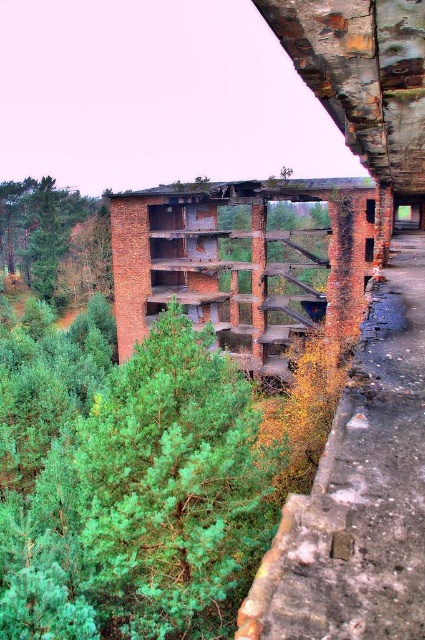
Is rusty brick bridge at center positioned in front of rusty metal overpass at upper center?

No, rusty brick bridge at center is further to the viewer.

Between point (269, 188) and point (424, 22), which one is positioned in front?

Point (424, 22)

Locate an element on the screen. The width and height of the screenshot is (425, 640). rusty brick bridge at center is located at coordinates (240, 262).

Which is in front, point (252, 244) or point (68, 256)?

Point (252, 244) is in front.

Is point (147, 292) farther from camera compared to point (28, 212)?

No, (147, 292) is closer to viewer.

Does point (186, 289) come closer to viewer compared to point (64, 304)?

Yes, point (186, 289) is in front of point (64, 304).

Where is `rusty brick bridge at center`? The width and height of the screenshot is (425, 640). rusty brick bridge at center is located at coordinates (240, 262).

Does rusty metal overpass at upper center have a lesser width compared to green leafy tree at upper left?

Correct, rusty metal overpass at upper center's width is less than green leafy tree at upper left's.

Does rusty metal overpass at upper center appear on the left side of green leafy tree at upper left?

No, rusty metal overpass at upper center is not to the left of green leafy tree at upper left.

Is point (387, 26) farther from camera compared to point (102, 253)?

No.

Identify the location of rusty metal overpass at upper center. click(362, 76).